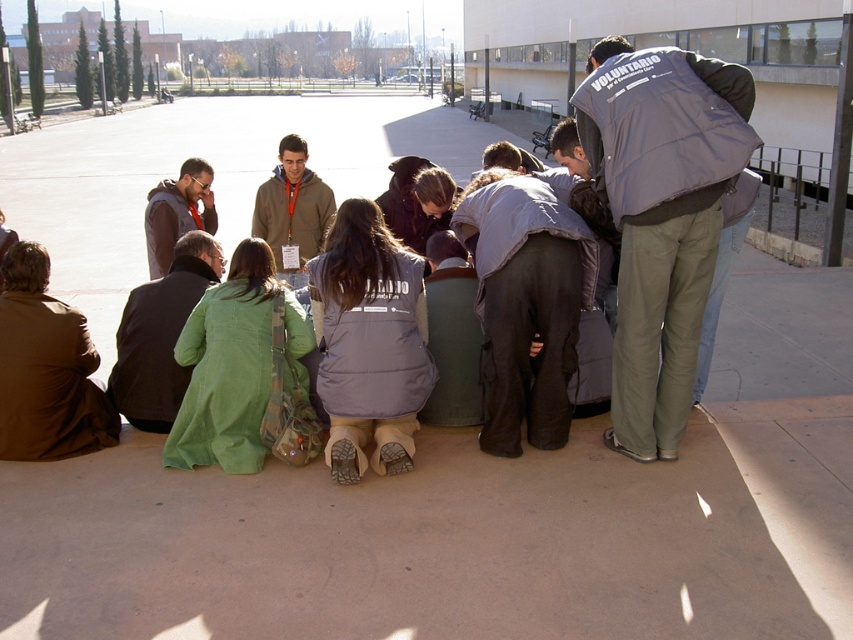
Question: Does green fabric jacket at lower left have a lesser width compared to matte brown hoodie at center?

Choices:
 (A) yes
 (B) no

Answer: (A)

Question: Which of the following is the closest to the observer?

Choices:
 (A) matte brown jacket at lower left
 (B) gray fabric jacket at center
 (C) matte brown hoodie at center

Answer: (B)

Question: Where is gray puffy vest at center located in relation to green fabric jacket at lower left in the image?

Choices:
 (A) above
 (B) below

Answer: (A)

Question: Which point is farther to the camera?

Choices:
 (A) matte brown hoodie at center
 (B) gray fabric jacket at center

Answer: (A)

Question: Where is gray puffy vest at center located in relation to matte brown hoodie at center in the image?

Choices:
 (A) above
 (B) below

Answer: (B)

Question: Which is farther from the gray puffy vest at center?

Choices:
 (A) gray fabric jacket at center
 (B) matte brown jacket at lower left
 (C) matte brown hoodie at center

Answer: (B)